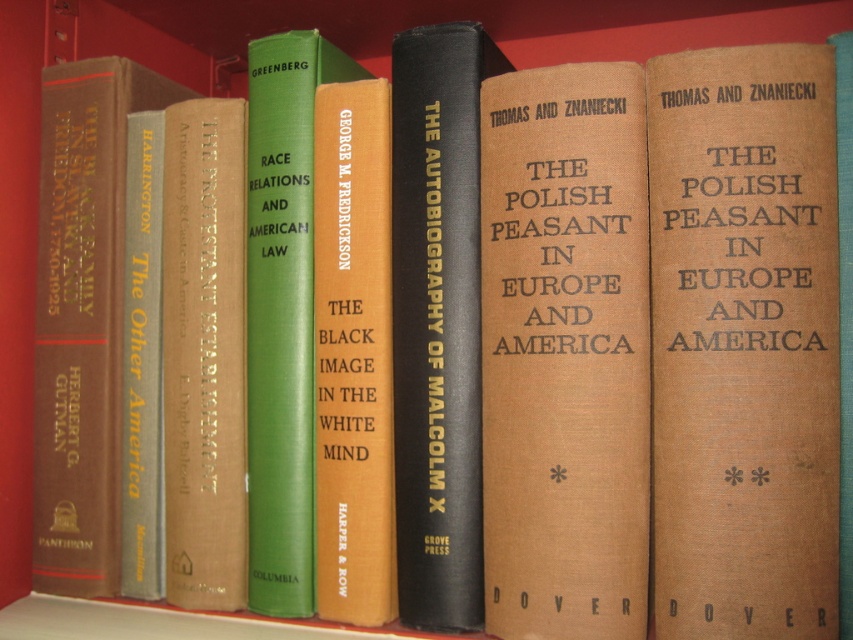
Question: Considering the relative positions of brown cloth book at center and hardcover book at center in the image provided, where is brown cloth book at center located with respect to hardcover book at center?

Choices:
 (A) above
 (B) below

Answer: (B)

Question: Which of the following is the farthest from the observer?

Choices:
 (A) brown cloth book at center
 (B) hardcover book at center
 (C) brown paper book at center
 (D) matte gray book at center

Answer: (D)

Question: Where is brown cloth book at center located in relation to brown paper book at center in the image?

Choices:
 (A) right
 (B) left

Answer: (A)

Question: Which is nearer to the green hardcover book at center?

Choices:
 (A) brown textured book at right
 (B) hardcover book at center
 (C) orange hardcover book at center
 (D) brown leather book at left

Answer: (C)

Question: Is hardcover book at center wider than brown paper book at center?

Choices:
 (A) no
 (B) yes

Answer: (B)

Question: Which point is farther from the camera taking this photo?

Choices:
 (A) (123, 440)
 (B) (515, 269)
 (C) (178, 131)
 (D) (357, 376)

Answer: (A)